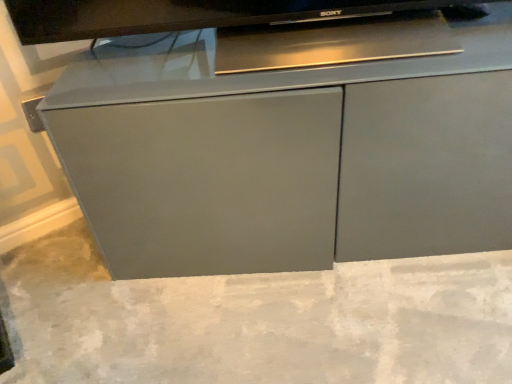
Locate an element on the screen. This screenshot has height=384, width=512. free space in front of matte gray cabinet at center is located at coordinates (349, 317).